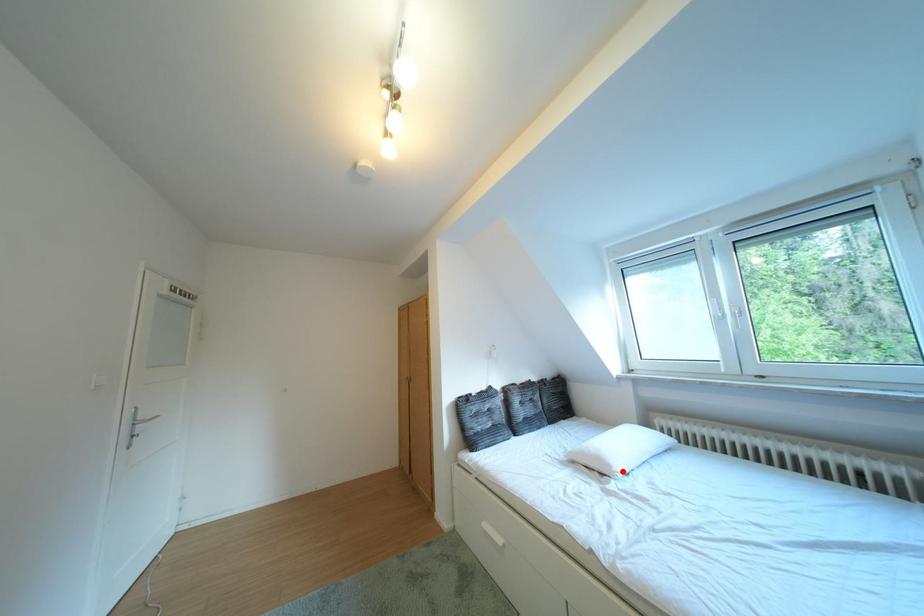
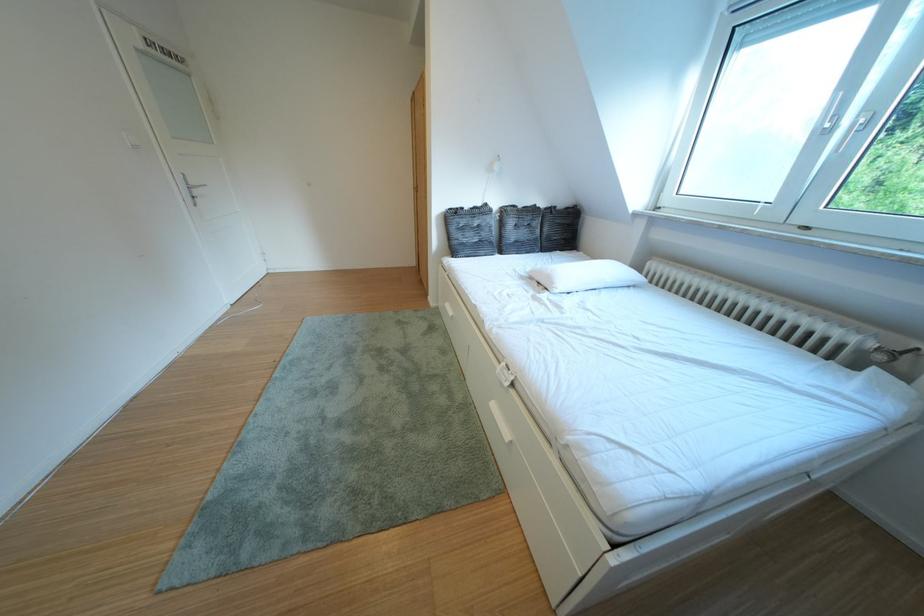
Question: I am providing you with two images of the same scene from different viewpoints. Image1 has a red point marked. In image2, the corresponding 3D location appears at what relative position? Reply with the corresponding letter.

Choices:
 (A) Closer
 (B) Farther

Answer: (A)